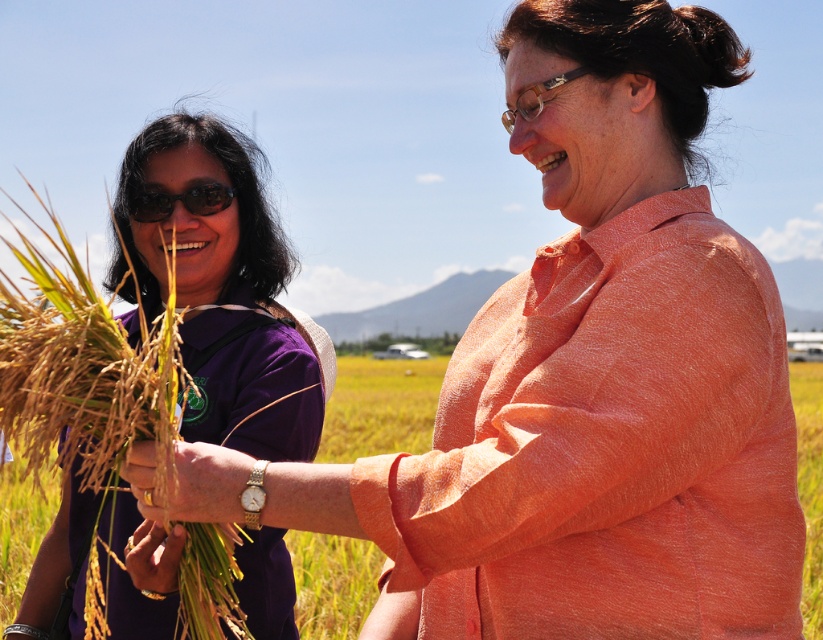
You are a photographer taking a picture of the purple fabric shirt at left and the matte black sunglasses at left. Which object should you focus on first if you want to capture both in the frame without moving the camera?

The purple fabric shirt at left is positioned on the left side of matte black sunglasses at left, so you should focus on the purple fabric shirt at left first to ensure both are in the frame without moving the camera.

Looking at this image, you are a photographer taking a picture of the two people in the rural field. You notice the purple fabric shirt at left and the matte black sunglasses at left. Which object should you adjust your focus on if you want to ensure the one that is lower in the frame is sharp?

You should focus on the purple fabric shirt at left because it is positioned below the matte black sunglasses at left, making it the lower object in the frame.

You are a photographer trying to capture a clear photo of the purple fabric shirt at left and the matte black sunglasses at left. Since you want both items to be in focus, which one should you adjust your camera lens to prioritize focusing on first?

The purple fabric shirt at left is closer to the viewer than the matte black sunglasses at left, so you should focus on the purple fabric shirt at left first. This ensures both items will be in focus as they are at different distances from the camera.